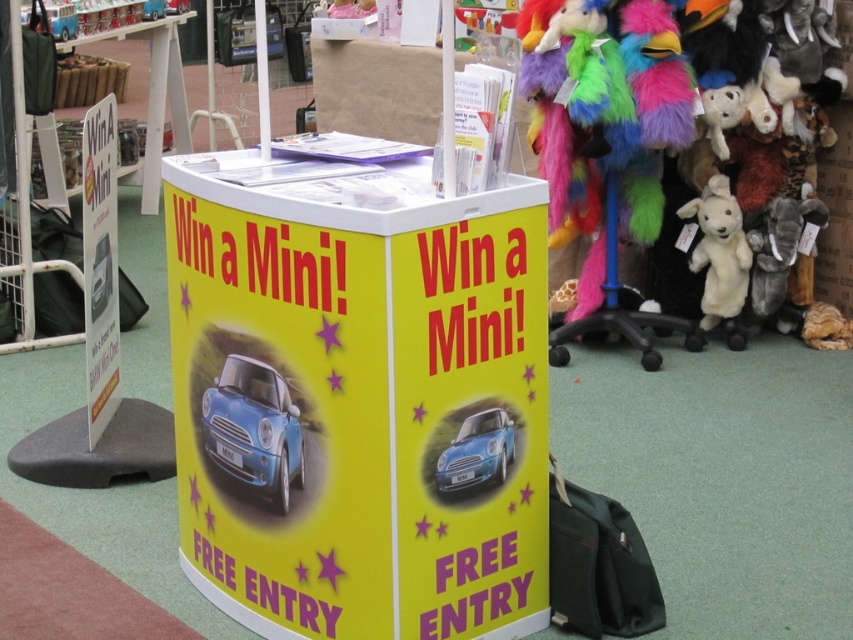
You are a fair attendee who wants to take a photo with the fluffy plush parrot at right and the shiny blue car at center. Which object should you stand closer to in order to capture both in the same frame without zooming in or out?

You should stand closer to the shiny blue car at center because the fluffy plush parrot at right is bigger than the shiny blue car at center, so moving closer to the smaller object helps balance their sizes in the photo frame.

You are a visitor at the fair and want to pick up the white plush lamb at right. You are currently standing 2 meters away from the promotional display stand. Can you reach the lamb without moving closer?

The distance between you and the white plush lamb at right is 4.65 meters, so you cannot reach it without moving closer since you are only 2 meters away from the stand.